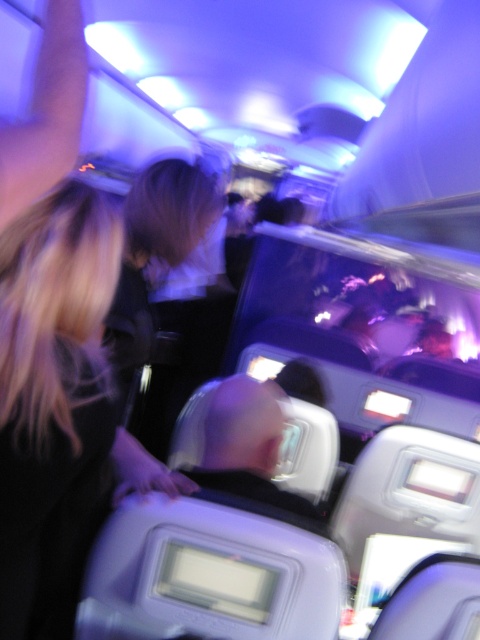
Is blonde hair at left shorter than smooth skin head at center?

Incorrect, blonde hair at left's height does not fall short of smooth skin head at center's.

Is blonde hair at left smaller than smooth skin head at center?

Actually, blonde hair at left might be larger than smooth skin head at center.

Does point (62, 374) come behind point (230, 387)?

No.

Where is `blonde hair at left`? blonde hair at left is located at coordinates click(x=54, y=403).